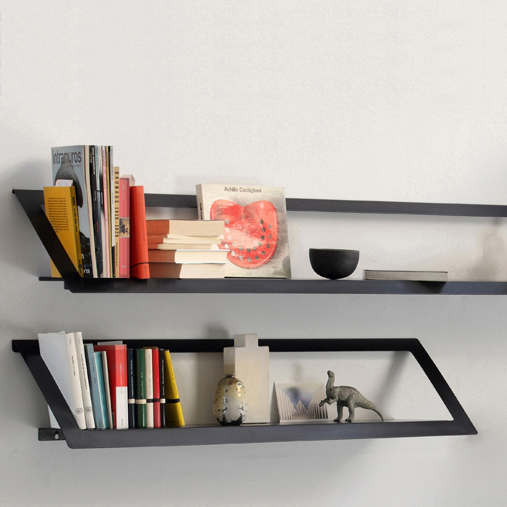
Where is `horizontally stacked book`? horizontally stacked book is located at coordinates (199, 270), (191, 260), (168, 247), (165, 242), (173, 236), (181, 223).